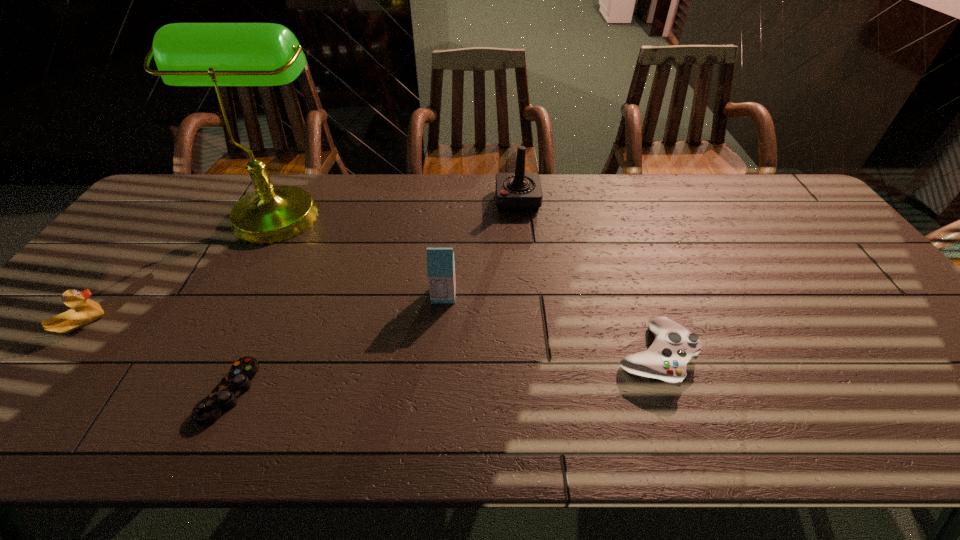
At what (x,y) coordinates should I click in order to perform the action: click on lamp. Please return your answer as a coordinate pair (x, y). This screenshot has height=540, width=960. Looking at the image, I should click on click(187, 54).

The image size is (960, 540). I want to click on the second tallest object, so click(515, 192).

In order to click on joystick in this screenshot , I will do `click(515, 192)`.

Find the location of `the third object from right to left`. the third object from right to left is located at coordinates (440, 261).

The width and height of the screenshot is (960, 540). In order to click on the fourth nearest object in this screenshot , I will do `click(440, 261)`.

Locate an element on the screen. The width and height of the screenshot is (960, 540). the fourth tallest object is located at coordinates (83, 311).

Identify the location of the leftmost object. (83, 311).

Where is `the fifth tallest object`? The height and width of the screenshot is (540, 960). the fifth tallest object is located at coordinates (674, 346).

This screenshot has width=960, height=540. What are the coordinates of `the rightmost object` in the screenshot? It's located at (674, 346).

Find the location of a particular element. Image resolution: width=960 pixels, height=540 pixels. the shortest object is located at coordinates (224, 396).